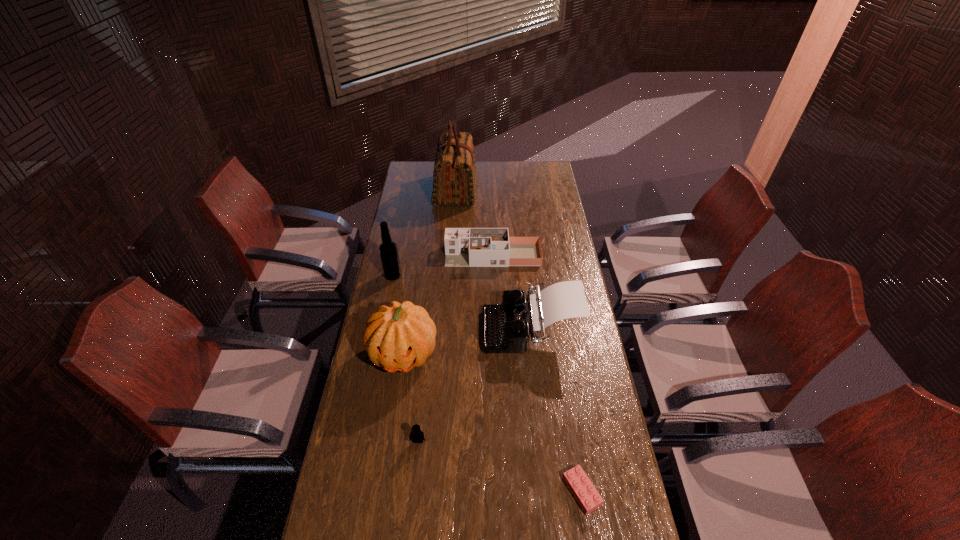
Identify the location of the tallest object. (454, 178).

Where is `shopping bag`? This screenshot has width=960, height=540. shopping bag is located at coordinates (454, 178).

Identify the location of beer bottle. (388, 250).

Identify the location of pumpkin. Image resolution: width=960 pixels, height=540 pixels. (399, 337).

Find the location of a particular element. The width and height of the screenshot is (960, 540). typewriter is located at coordinates (506, 327).

Identify the location of dollhouse. (464, 247).

Identify the location of the second shortest object. (417, 435).

This screenshot has height=540, width=960. I want to click on the taller Lego, so click(x=417, y=435).

Image resolution: width=960 pixels, height=540 pixels. Identify the location of the shorter Lego. (582, 489).

Identify the location of the right Lego. (582, 489).